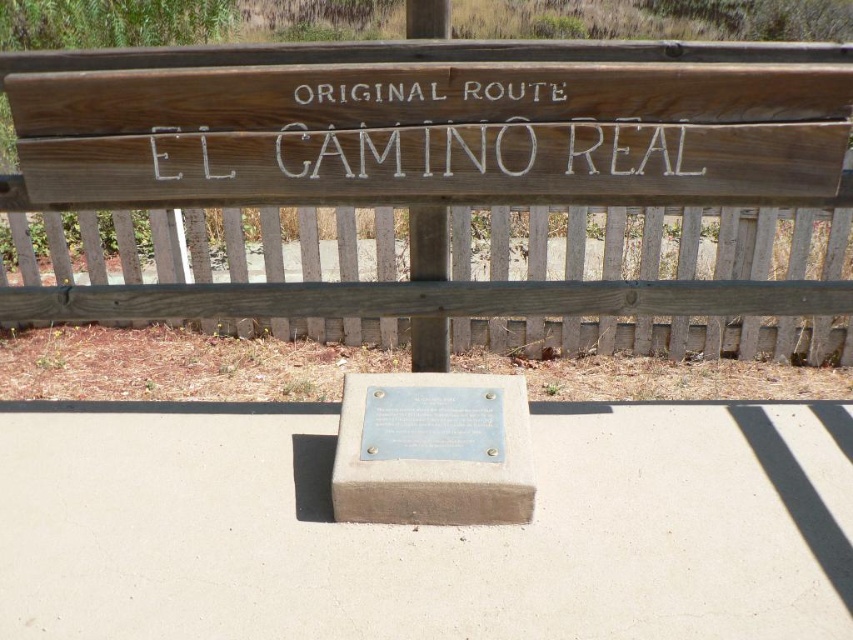
From the picture: Does wooden sign at center have a lesser width compared to gray concrete plaque at center?

No.

Can you confirm if wooden sign at center is bigger than gray concrete plaque at center?

Correct, wooden sign at center is larger in size than gray concrete plaque at center.

Who is more forward, (641, 182) or (515, 394)?

Point (641, 182) is in front.

Where is `wooden sign at center`? The height and width of the screenshot is (640, 853). wooden sign at center is located at coordinates (430, 132).